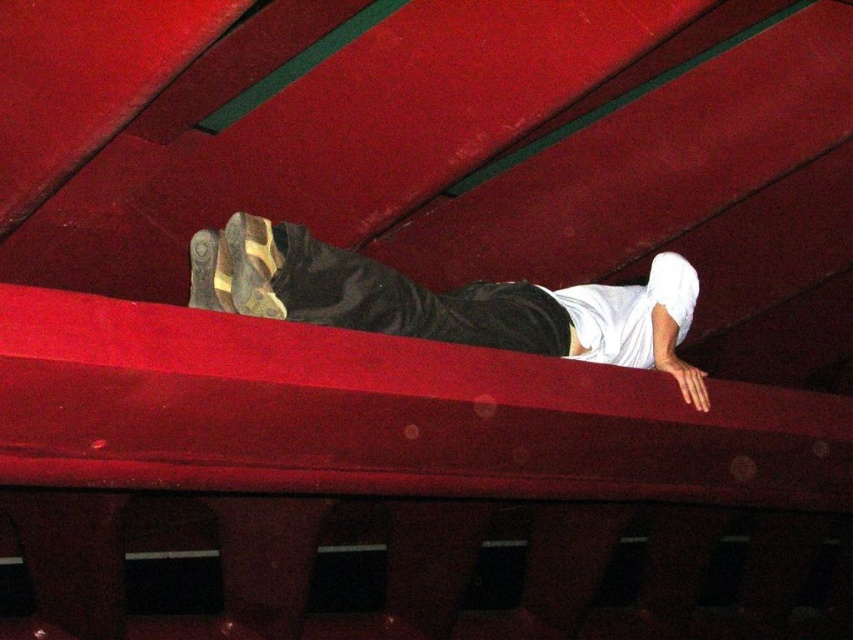
Is smooth red beam at center closer to the viewer compared to matte black pants at upper center?

That is True.

Which is behind, point (538, 419) or point (614, 362)?

The point (614, 362) is behind.

The height and width of the screenshot is (640, 853). I want to click on smooth red beam at center, so point(380,416).